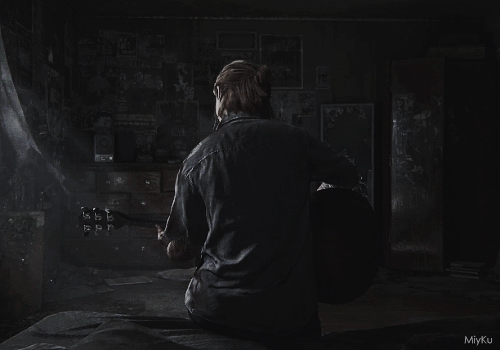
The width and height of the screenshot is (500, 350). I want to click on dresser, so click(x=127, y=198).